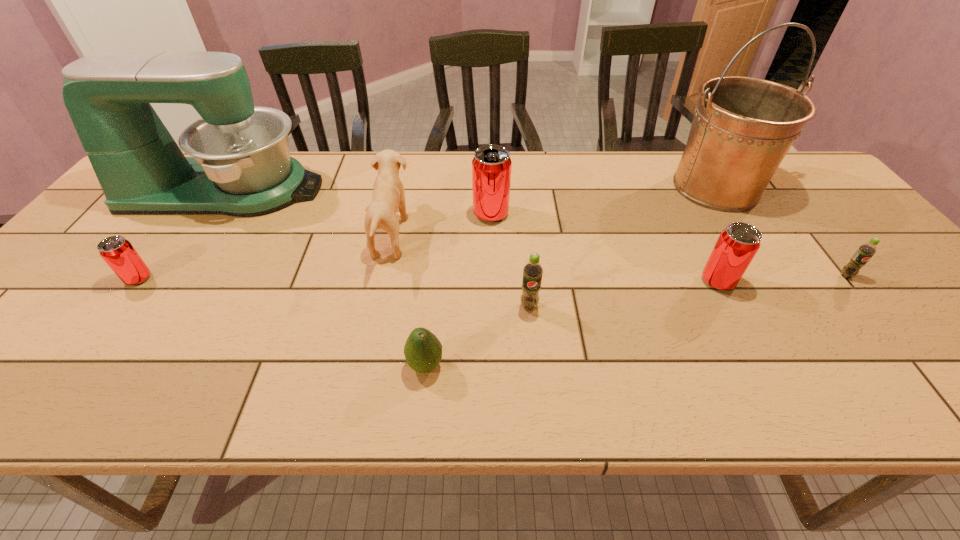
The image size is (960, 540). Find the location of `the smallest red soda can`. the smallest red soda can is located at coordinates (118, 252).

Where is `the leftmost red soda can`? Image resolution: width=960 pixels, height=540 pixels. the leftmost red soda can is located at coordinates (118, 252).

You are a GUI agent. You are given a task and a screenshot of the screen. Output one action in this format:
    pyautogui.click(x=<x>, y=<y>)
    Task: Click on the farther green soda
    Image resolution: width=960 pixels, height=540 pixels.
    Given the screenshot: What is the action you would take?
    pyautogui.click(x=866, y=251)

Find the location of a particular element. Image resolution: width=960 pixels, height=540 pixels. the right green soda is located at coordinates (866, 251).

This screenshot has height=540, width=960. In order to click on the nearest object in this screenshot , I will do `click(423, 351)`.

Find the location of a particular element. avocado is located at coordinates (423, 351).

In order to click on vacant region located on the front of the tallest object in this screenshot , I will do `click(747, 235)`.

Identify the location of vacant area situated 0.310m on the front-facing side of the mixer. (425, 190).

Locate an element on the screen. This screenshot has width=960, height=540. vacant space situated on the left of the second red soda can from right to left is located at coordinates (346, 214).

Locate an element on the screen. The width and height of the screenshot is (960, 540). vacant space situated 0.330m on the left side of the puppy is located at coordinates (535, 235).